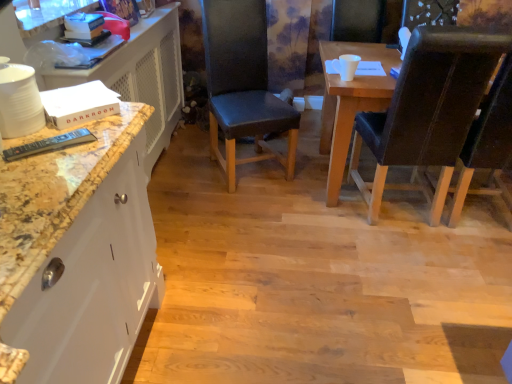
Question: Considering the relative sizes of black leather chair at right, which is the second chair in right-to-left order, and marble/dark brown dresser at left in the image provided, is black leather chair at right, which is the second chair in right-to-left order, smaller than marble/dark brown dresser at left?

Choices:
 (A) no
 (B) yes

Answer: (B)

Question: Does black leather chair at right, the 2th chair viewed from the left, contain marble/dark brown dresser at left?

Choices:
 (A) yes
 (B) no

Answer: (B)

Question: From the image's perspective, is black leather chair at right, the 2th chair viewed from the left, above marble/dark brown dresser at left?

Choices:
 (A) no
 (B) yes

Answer: (A)

Question: Can you confirm if black leather chair at right, which is the second chair in right-to-left order, is positioned to the left of marble/dark brown dresser at left?

Choices:
 (A) yes
 (B) no

Answer: (B)

Question: Can you confirm if black leather chair at right, the 2th chair viewed from the left, is wider than marble/dark brown dresser at left?

Choices:
 (A) yes
 (B) no

Answer: (A)

Question: Considering the positions of black leather chair at right, which is the second chair in right-to-left order, and dark brown leather chair at right, placed as the 1th chair when sorted from right to left, in the image, is black leather chair at right, which is the second chair in right-to-left order, taller or shorter than dark brown leather chair at right, placed as the 1th chair when sorted from right to left,?

Choices:
 (A) tall
 (B) short

Answer: (A)

Question: Considering the relative positions of black leather chair at right, the 2th chair viewed from the left, and dark brown leather chair at right, arranged as the 3th chair when viewed from the left, in the image provided, is black leather chair at right, the 2th chair viewed from the left, to the left or to the right of dark brown leather chair at right, arranged as the 3th chair when viewed from the left,?

Choices:
 (A) right
 (B) left

Answer: (B)

Question: Does point (375, 130) appear closer or farther from the camera than point (501, 147)?

Choices:
 (A) closer
 (B) farther

Answer: (B)

Question: Considering their positions, is black leather chair at right, which is the second chair in right-to-left order, located in front of or behind dark brown leather chair at right, placed as the 1th chair when sorted from right to left?

Choices:
 (A) behind
 (B) front

Answer: (A)

Question: From the image's perspective, is dark brown leather chair at right, arranged as the 3th chair when viewed from the left, located above or below marble/dark brown dresser at left?

Choices:
 (A) below
 (B) above

Answer: (A)

Question: Is point (502, 183) positioned closer to the camera than point (151, 115)?

Choices:
 (A) farther
 (B) closer

Answer: (A)

Question: From a real-world perspective, is dark brown leather chair at right, placed as the 1th chair when sorted from right to left, positioned above or below marble/dark brown dresser at left?

Choices:
 (A) above
 (B) below

Answer: (A)

Question: Is dark brown leather chair at right, placed as the 1th chair when sorted from right to left, taller or shorter than marble/dark brown dresser at left?

Choices:
 (A) short
 (B) tall

Answer: (B)

Question: Considering the positions of point (501, 135) and point (244, 6), is point (501, 135) closer or farther from the camera than point (244, 6)?

Choices:
 (A) farther
 (B) closer

Answer: (B)

Question: In terms of width, does dark brown leather chair at right, placed as the 1th chair when sorted from right to left, look wider or thinner when compared to black leather chair at center, the third chair from the right?

Choices:
 (A) wide
 (B) thin

Answer: (A)